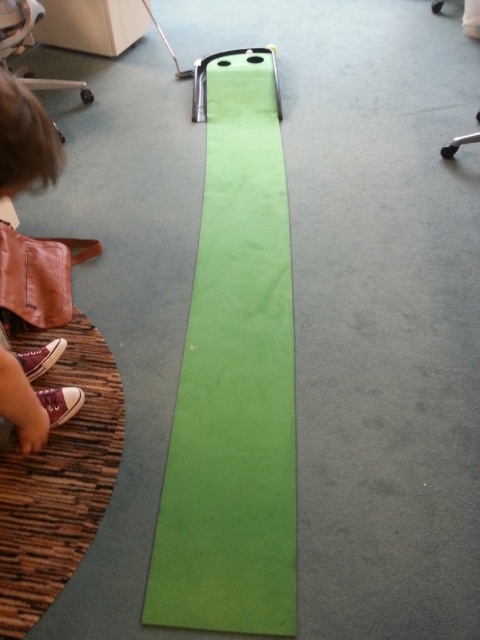
Is green matte strip at center taller than brown leather shoes at lower left?

Indeed, green matte strip at center has a greater height compared to brown leather shoes at lower left.

Can you confirm if green matte strip at center is smaller than brown leather shoes at lower left?

No, green matte strip at center is not smaller than brown leather shoes at lower left.

Find the location of a particular element. This screenshot has height=640, width=480. green matte strip at center is located at coordinates (233, 380).